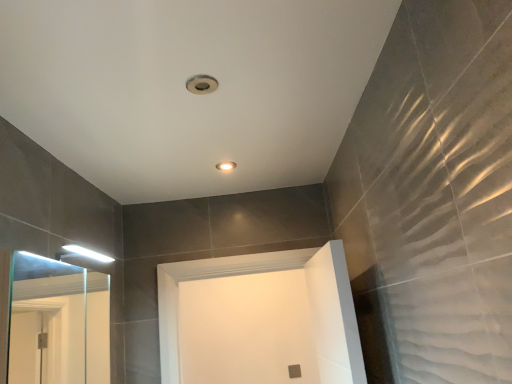
Measure the distance between point (x=31, y=301) and camera.

They are 2.64 meters apart.

Measure the distance between clear glass mirror at left and camera.

2.72 meters.

Image resolution: width=512 pixels, height=384 pixels. Describe the element at coordinates (53, 323) in the screenshot. I see `clear glass mirror at left` at that location.

The image size is (512, 384). I want to click on clear glass mirror at left, so click(53, 323).

At what (x,y) coordinates should I click in order to perform the action: click on clear glass mirror at left. Please return your answer as a coordinate pair (x, y). Looking at the image, I should click on (53, 323).